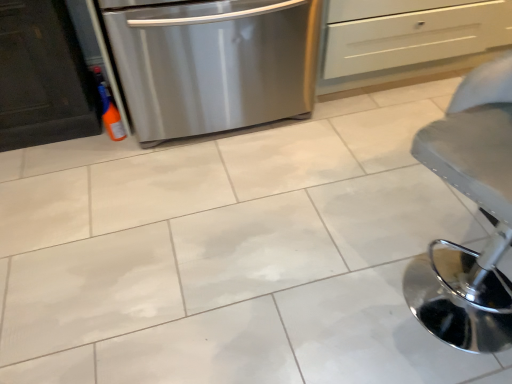
At what (x,y) coordinates should I click in order to perform the action: click on vacant space in front of stainless steel dishwasher at left. Please return your answer as a coordinate pair (x, y). The width and height of the screenshot is (512, 384). Looking at the image, I should click on (224, 199).